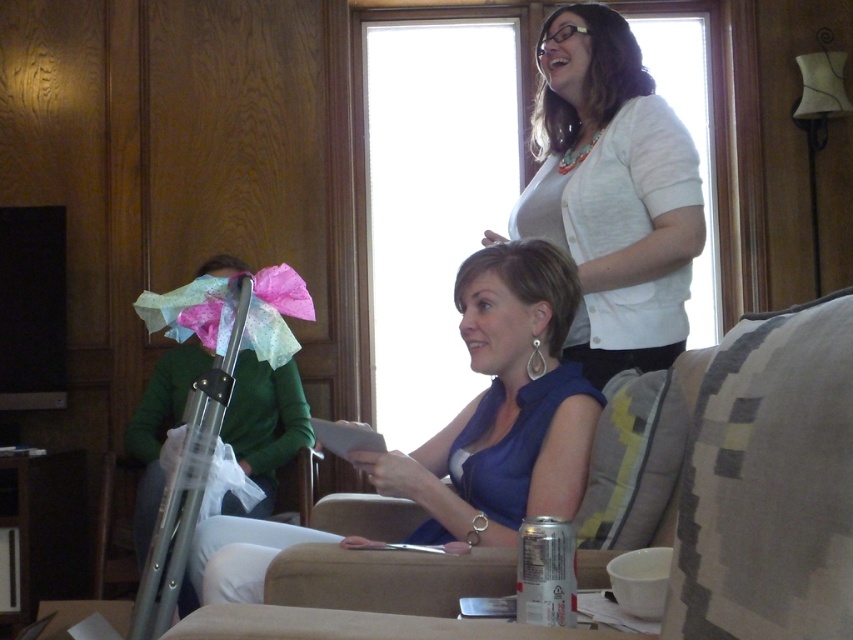
You are organizing a clothing donation drive and need to stack items vertically. The white matte cardigan at upper center and the green fabric shirt at left are both to be placed in a box. Based on their positions in the image, which one should you place at the bottom of the box to ensure stability?

The green fabric shirt at left should be placed at the bottom of the box because the white matte cardigan at upper center is located above it in the image, indicating it is higher up and thus should be placed on top for stability.

You are a fashion designer observing a living room scene. You notice two clothing items in the image. The first is a blue fabric dress at center and the second is a green fabric shirt at left. Which clothing item is positioned higher in the image?

The blue fabric dress at center is positioned higher than the green fabric shirt at left.